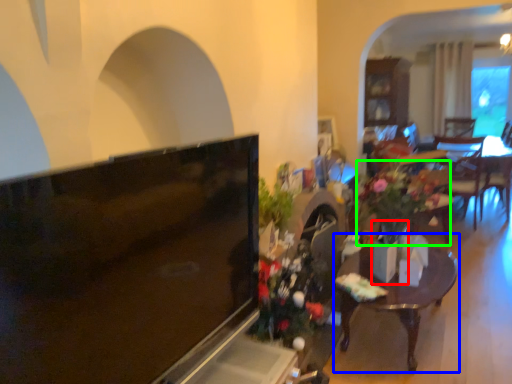
Question: Considering the real-world distances, which object is farthest from vase (highlighted by a red box)? table (highlighted by a blue box) or houseplant (highlighted by a green box)?

Choices:
 (A) table
 (B) houseplant

Answer: (A)